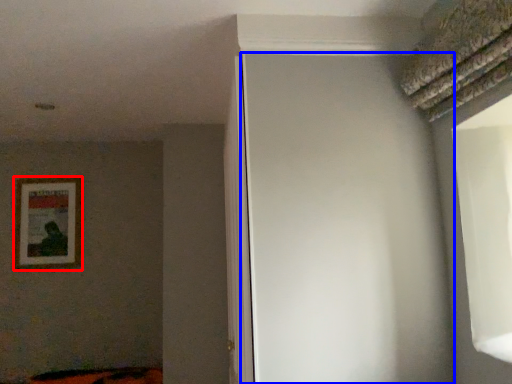
Question: Which object is closer to the camera taking this photo, picture frame (highlighted by a red box) or screen door (highlighted by a blue box)?

Choices:
 (A) picture frame
 (B) screen door

Answer: (B)